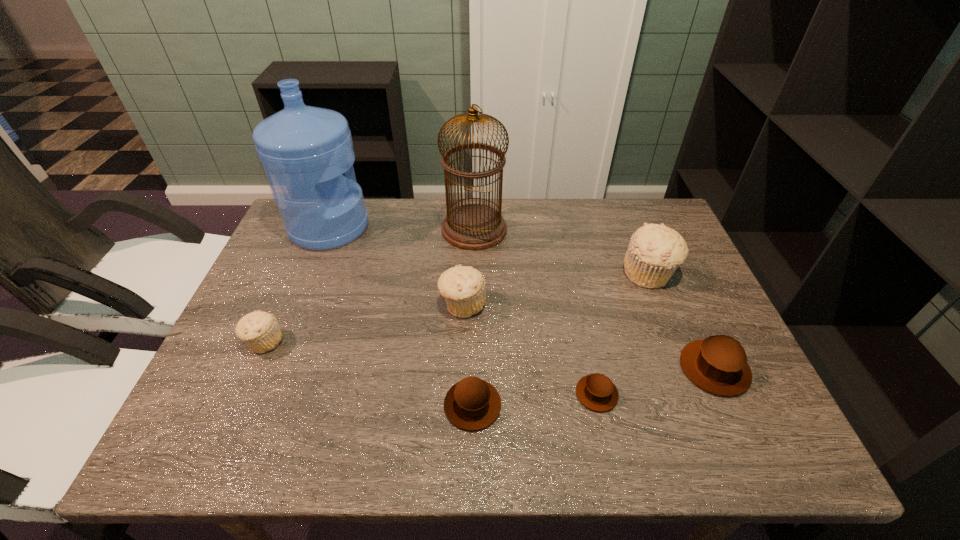
Locate an element on the screen. This screenshot has width=960, height=540. object that is the seventh closest to the birdcage is located at coordinates pos(718,364).

Select which muffin appears as the second closest to the biggest beige muffin. Please provide its 2D coordinates. Your answer should be formatted as a tuple, i.e. [(x, y)], where the tuple contains the x and y coordinates of a point satisfying the conditions above.

[(597, 392)]

Identify which muffin is located as the third nearest to the shortest muffin. Please provide its 2D coordinates. Your answer should be formatted as a tuple, i.e. [(x, y)], where the tuple contains the x and y coordinates of a point satisfying the conditions above.

[(463, 287)]

Identify which beige muffin is the third nearest to the birdcage. Please provide its 2D coordinates. Your answer should be formatted as a tuple, i.e. [(x, y)], where the tuple contains the x and y coordinates of a point satisfying the conditions above.

[(259, 330)]

Identify the location of the second closest beige muffin to the birdcage. The image size is (960, 540). (655, 251).

Identify the location of brown muffin identified as the second closest to the leftmost muffin. (597, 392).

Select which brown muffin appears as the closest to the smallest brown muffin. Please provide its 2D coordinates. Your answer should be formatted as a tuple, i.e. [(x, y)], where the tuple contains the x and y coordinates of a point satisfying the conditions above.

[(718, 364)]

The height and width of the screenshot is (540, 960). I want to click on free space that satisfies the following two spatial constraints: 1. on the side of the shortest object with the handle; 2. on the left side of the blue water jug, so click(x=262, y=394).

You are a GUI agent. You are given a task and a screenshot of the screen. Output one action in this format:
    pyautogui.click(x=<x>, y=<y>)
    Task: Click on the free location that satisfies the following two spatial constraints: 1. on the side of the blue water jug with the handle; 2. on the back side of the biggest brown muffin
    
    Given the screenshot: What is the action you would take?
    (273, 369)

The image size is (960, 540). I want to click on vacant space that satisfies the following two spatial constraints: 1. on the side of the blue water jug with the handle; 2. on the left side of the rightmost beige muffin, so click(x=311, y=273).